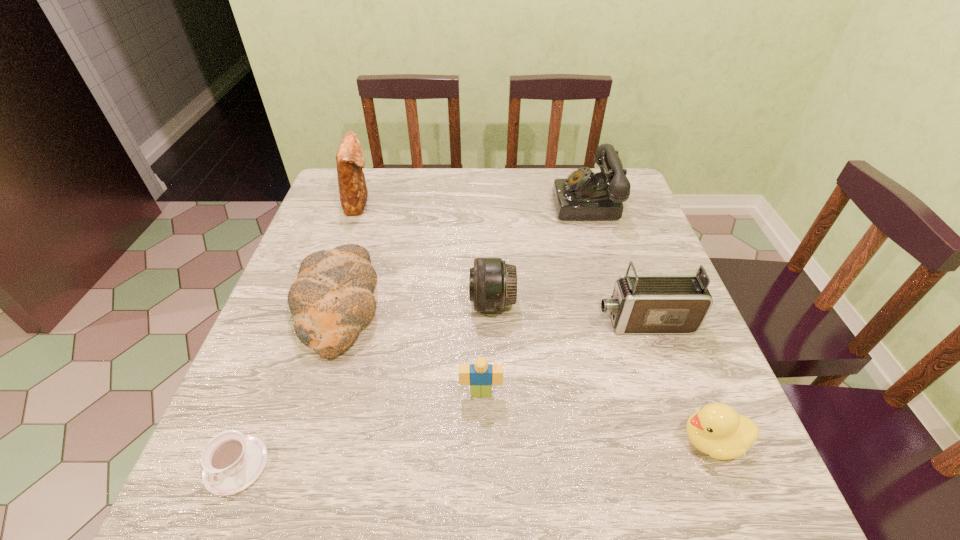
This screenshot has width=960, height=540. I want to click on telephone situated at the right edge, so [x=583, y=195].

I want to click on camcorder that is at the right edge, so click(642, 304).

You are a GUI agent. You are given a task and a screenshot of the screen. Output one action in this format:
    pyautogui.click(x=<x>, y=<y>)
    Task: Click on the duckling at the right edge
    
    Given the screenshot: What is the action you would take?
    pos(716,429)

The image size is (960, 540). Identify the location of object that is at the far left corner. [x=350, y=160].

The width and height of the screenshot is (960, 540). What are the coordinates of `object present at the near left corner` in the screenshot? It's located at (231, 461).

This screenshot has width=960, height=540. I want to click on object that is at the far right corner, so click(583, 195).

Find the location of a particular element. object that is at the near right corner is located at coordinates (716, 429).

You are a GUI agent. You are given a task and a screenshot of the screen. Output one action in this format:
    pyautogui.click(x=<x>, y=<y>)
    Task: Click on the free space at the far edge of the desktop
    The image size is (960, 540).
    Given the screenshot: What is the action you would take?
    pyautogui.click(x=460, y=206)

In order to click on vacant region at the near edge in this screenshot , I will do `click(540, 488)`.

The image size is (960, 540). Find the location of `vacant area at the left edge`. vacant area at the left edge is located at coordinates (335, 233).